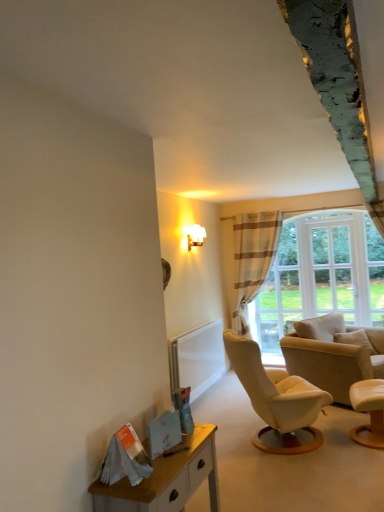
Question: From the image's perspective, is wooden desk at lower left located above striped fabric curtain at center?

Choices:
 (A) no
 (B) yes

Answer: (A)

Question: Considering the relative sizes of wooden desk at lower left and striped fabric curtain at center in the image provided, is wooden desk at lower left bigger than striped fabric curtain at center?

Choices:
 (A) yes
 (B) no

Answer: (B)

Question: Is the depth of wooden desk at lower left greater than that of striped fabric curtain at center?

Choices:
 (A) yes
 (B) no

Answer: (B)

Question: Is wooden desk at lower left at the left side of striped fabric curtain at center?

Choices:
 (A) no
 (B) yes

Answer: (B)

Question: Is wooden desk at lower left not near striped fabric curtain at center?

Choices:
 (A) yes
 (B) no

Answer: (A)

Question: Does wooden desk at lower left have a smaller size compared to striped fabric curtain at center?

Choices:
 (A) yes
 (B) no

Answer: (A)

Question: Is white glass window at upper right to the right of beige leather chair at right, arranged as the 2th chair when viewed from the front, from the viewer's perspective?

Choices:
 (A) no
 (B) yes

Answer: (B)

Question: Is white glass window at upper right not close to beige leather chair at right, the first chair in the back-to-front sequence?

Choices:
 (A) yes
 (B) no

Answer: (B)

Question: Is white glass window at upper right next to beige leather chair at right, arranged as the 2th chair when viewed from the front?

Choices:
 (A) no
 (B) yes

Answer: (A)

Question: From the image's perspective, would you say white glass window at upper right is shown under beige leather chair at right, the first chair in the back-to-front sequence?

Choices:
 (A) no
 (B) yes

Answer: (A)

Question: Is white glass window at upper right outside of beige leather chair at right, the first chair in the back-to-front sequence?

Choices:
 (A) no
 (B) yes

Answer: (B)

Question: From a real-world perspective, is white glass window at upper right beneath beige leather chair at right, the first chair in the back-to-front sequence?

Choices:
 (A) no
 (B) yes

Answer: (A)

Question: Is wooden desk at lower left oriented away from beige leather chair at right, arranged as the 2th chair when viewed from the front?

Choices:
 (A) no
 (B) yes

Answer: (A)